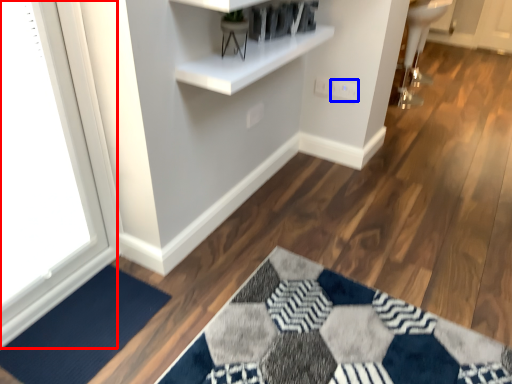
Question: Which object appears closest to the camera in this image, window (highlighted by a red box) or electric outlet (highlighted by a blue box)?

Choices:
 (A) window
 (B) electric outlet

Answer: (A)